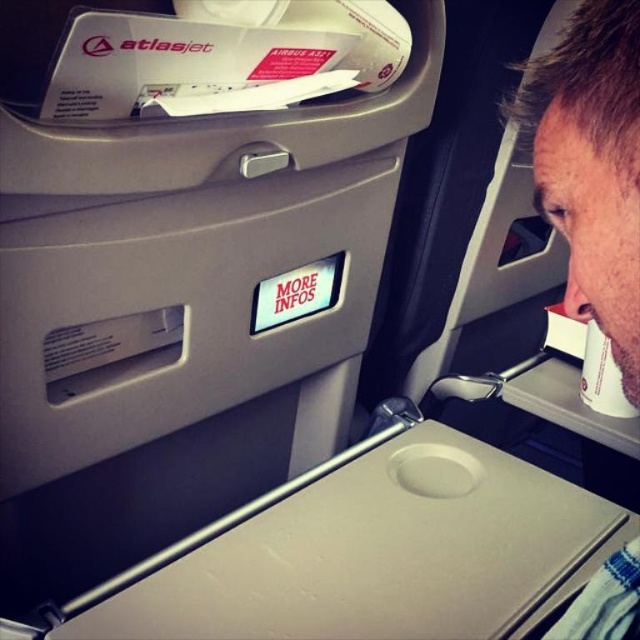
Question: Among these objects, which one is nearest to the camera?

Choices:
 (A) beige fabric headrest at upper right
 (B) white paper cup at right

Answer: (A)

Question: Which of the following is the farthest from the observer?

Choices:
 (A) beige fabric headrest at upper right
 (B) white paper cup at right

Answer: (B)

Question: Which point is farther from the camera taking this photo?

Choices:
 (A) (620, 417)
 (B) (556, 637)

Answer: (A)

Question: Is beige fabric headrest at upper right below white paper cup at right?

Choices:
 (A) yes
 (B) no

Answer: (B)

Question: Does beige fabric headrest at upper right appear on the right side of white paper cup at right?

Choices:
 (A) no
 (B) yes

Answer: (A)

Question: Where is beige fabric headrest at upper right located in relation to white paper cup at right in the image?

Choices:
 (A) right
 (B) left

Answer: (B)